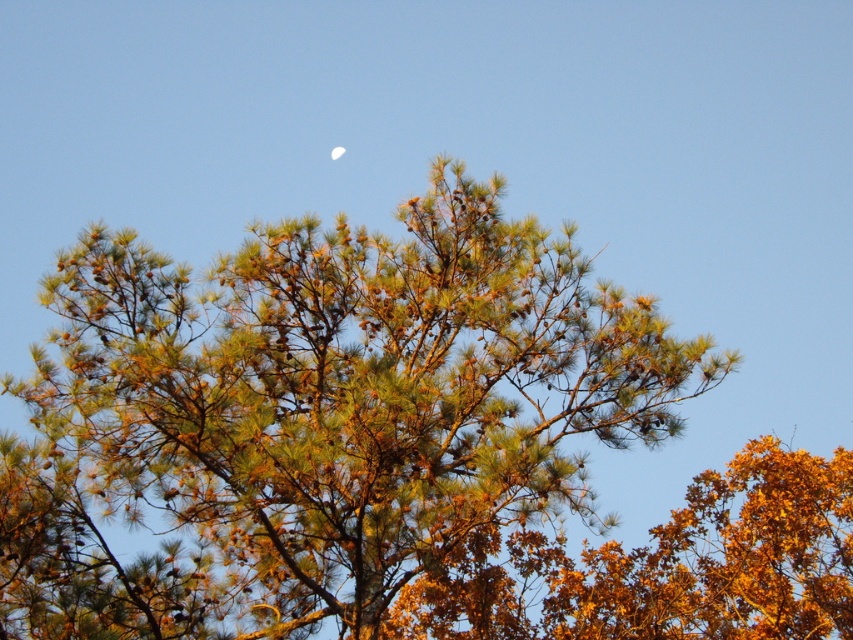
Question: Does green needle-like at center appear over white glossy moon at upper center?

Choices:
 (A) yes
 (B) no

Answer: (B)

Question: Among these points, which one is farthest from the camera?

Choices:
 (A) (338, 156)
 (B) (482, 369)

Answer: (A)

Question: Does green needle-like at center appear on the right side of white glossy moon at upper center?

Choices:
 (A) yes
 (B) no

Answer: (A)

Question: Does green needle-like at center have a greater width compared to white glossy moon at upper center?

Choices:
 (A) no
 (B) yes

Answer: (B)

Question: Which point appears closest to the camera in this image?

Choices:
 (A) (335, 480)
 (B) (341, 148)

Answer: (A)